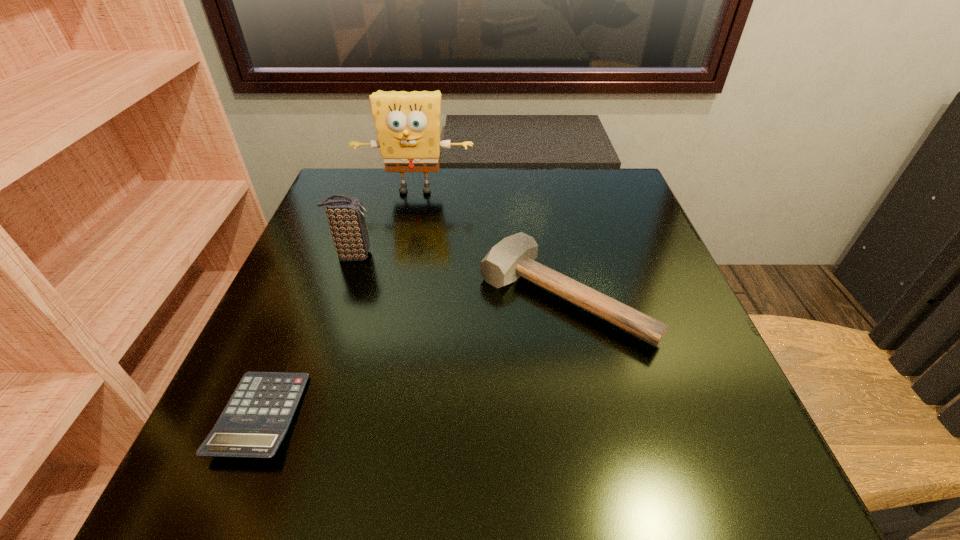
The width and height of the screenshot is (960, 540). What are the coordinates of `vacant space situated 0.310m on the right of the nearest object` in the screenshot? It's located at (507, 416).

Locate an element on the screen. Image resolution: width=960 pixels, height=540 pixels. object situated at the far edge is located at coordinates (408, 123).

Identify the location of object that is at the near edge. Image resolution: width=960 pixels, height=540 pixels. (254, 422).

Where is `sponge at the left edge`? This screenshot has height=540, width=960. sponge at the left edge is located at coordinates click(x=408, y=123).

Where is `clutch bag at the left edge`? clutch bag at the left edge is located at coordinates (346, 218).

Locate an element on the screen. The width and height of the screenshot is (960, 540). calculator present at the left edge is located at coordinates (254, 422).

The image size is (960, 540). I want to click on object at the right edge, so click(x=512, y=257).

Identify the location of object at the far left corner. The height and width of the screenshot is (540, 960). (408, 123).

What are the coordinates of `object at the near left corner` in the screenshot? It's located at (254, 422).

I want to click on vacant space at the far edge, so click(507, 181).